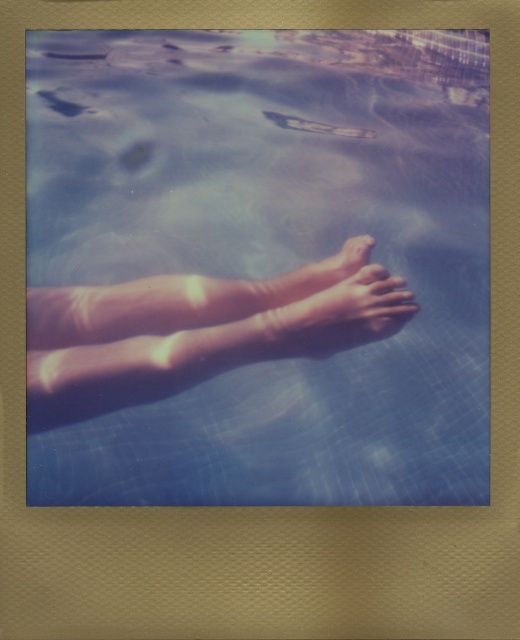
Looking at this image, does smooth skin feet at center have a smaller size compared to smooth skin foot at center?

Incorrect, smooth skin feet at center is not smaller in size than smooth skin foot at center.

Who is higher up, smooth skin feet at center or smooth skin foot at center?

smooth skin foot at center is higher up.

Is point (391, 317) positioned before point (339, 275)?

Yes.

Locate an element on the screen. This screenshot has height=640, width=520. smooth skin feet at center is located at coordinates (334, 310).

Between transparent blue water at center and smooth skin feet at center, which one has more height?

transparent blue water at center

What do you see at coordinates (256, 268) in the screenshot? Image resolution: width=520 pixels, height=640 pixels. I see `transparent blue water at center` at bounding box center [256, 268].

The width and height of the screenshot is (520, 640). What are the coordinates of `transparent blue water at center` in the screenshot? It's located at (256, 268).

Between point (175, 312) and point (322, 264), which one is positioned behind?

The point (322, 264) is behind.

Between transparent blue water at center and smooth skin foot at center, which one appears on the left side from the viewer's perspective?

Positioned to the left is transparent blue water at center.

Where is `transparent blue water at center`? Image resolution: width=520 pixels, height=640 pixels. transparent blue water at center is located at coordinates (256, 268).

Where is `transparent blue water at center`? The height and width of the screenshot is (640, 520). transparent blue water at center is located at coordinates (256, 268).